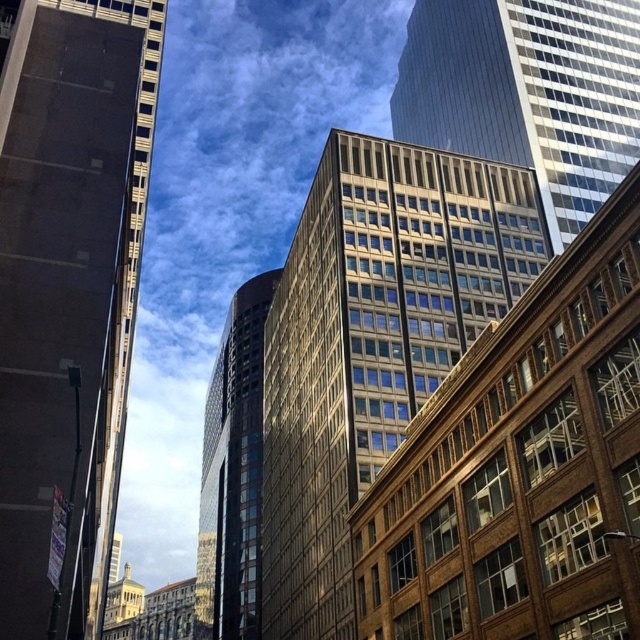
You are a city planner assessing the spacing between two glassy reflective structures in the urban scene. Given that the minimum required distance between such buildings for proper ventilation is 30 meters, can the glassy reflective building at center and the glassy reflective skyscraper at center meet this requirement?

The glassy reflective building at center and the glassy reflective skyscraper at center are 35.79 meters apart from each other, which exceeds the minimum required distance of 30 meters for proper ventilation. Therefore, they meet the requirement.

You are standing in the middle of the city and see the dark glass skyscraper at left and the glassy reflective tower at center. Which building is positioned to the right of the other?

The dark glass skyscraper at left is to the right of the glassy reflective tower at center.

You are an architect analyzing the urban layout. Based on the scene, which of the two buildings, the glassy reflective building at center or the glassy reflective skyscraper at center, is positioned lower in the image?

The glassy reflective building at center is located below the glassy reflective skyscraper at center, so it is positioned lower in the image.